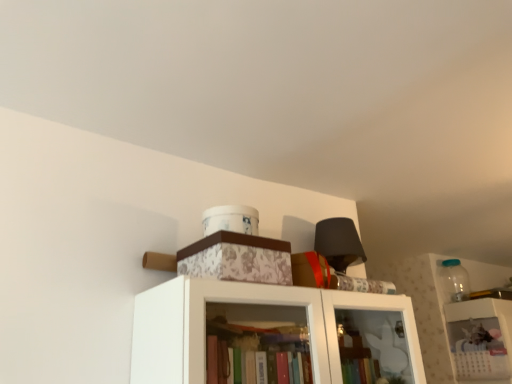
Question: From a real-world perspective, is transparent glass jar at upper right positioned under floral-patterned cardboard box at upper center based on gravity?

Choices:
 (A) yes
 (B) no

Answer: (B)

Question: Is transparent glass jar at upper right oriented away from floral-patterned cardboard box at upper center?

Choices:
 (A) yes
 (B) no

Answer: (B)

Question: Would you say floral-patterned cardboard box at upper center is part of transparent glass jar at upper right's contents?

Choices:
 (A) yes
 (B) no

Answer: (B)

Question: Is the position of transparent glass jar at upper right less distant than that of floral-patterned cardboard box at upper center?

Choices:
 (A) no
 (B) yes

Answer: (A)

Question: Could you tell me if transparent glass jar at upper right is facing floral-patterned cardboard box at upper center?

Choices:
 (A) yes
 (B) no

Answer: (B)

Question: Is transparent glass jar at upper right thinner than floral-patterned cardboard box at upper center?

Choices:
 (A) yes
 (B) no

Answer: (A)

Question: From the image's perspective, does floral-patterned cardboard box at upper center appear lower than white paper calendar at upper right?

Choices:
 (A) no
 (B) yes

Answer: (A)

Question: Can you confirm if floral-patterned cardboard box at upper center is smaller than white paper calendar at upper right?

Choices:
 (A) no
 (B) yes

Answer: (B)

Question: Is floral-patterned cardboard box at upper center facing away from white paper calendar at upper right?

Choices:
 (A) yes
 (B) no

Answer: (B)

Question: From a real-world perspective, is floral-patterned cardboard box at upper center physically above white paper calendar at upper right?

Choices:
 (A) yes
 (B) no

Answer: (A)

Question: Considering the relative positions of floral-patterned cardboard box at upper center and white paper calendar at upper right in the image provided, is floral-patterned cardboard box at upper center to the right of white paper calendar at upper right from the viewer's perspective?

Choices:
 (A) no
 (B) yes

Answer: (A)

Question: Can you confirm if floral-patterned cardboard box at upper center is taller than white paper calendar at upper right?

Choices:
 (A) no
 (B) yes

Answer: (A)

Question: Considering the relative sizes of white paper calendar at upper right and floral-patterned cardboard box at upper center in the image provided, is white paper calendar at upper right shorter than floral-patterned cardboard box at upper center?

Choices:
 (A) no
 (B) yes

Answer: (A)